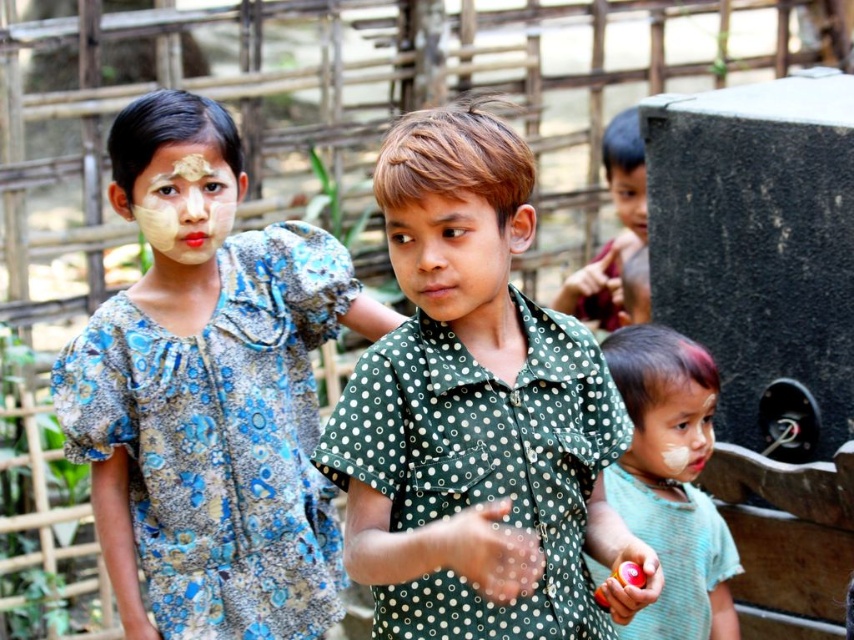
You are a photographer trying to capture the child in the blue floral dress at left. The point at coordinates (221, 440) is important for focusing your shot. Where exactly on the child should you aim your camera to ensure the focus is correct?

The point at coordinates (221, 440) is on the blue floral fabric dress at left, so you should aim your camera at the blue floral fabric dress to ensure proper focus on the child in the blue floral dress at left.

You are a photographer trying to capture a closeup shot of the two points in the image. Which point, point (703, 497) or point (612, 188), is closer to your camera lens?

Point (703, 497) is closer to the viewer than point (612, 188), so it is closer to the camera lens.